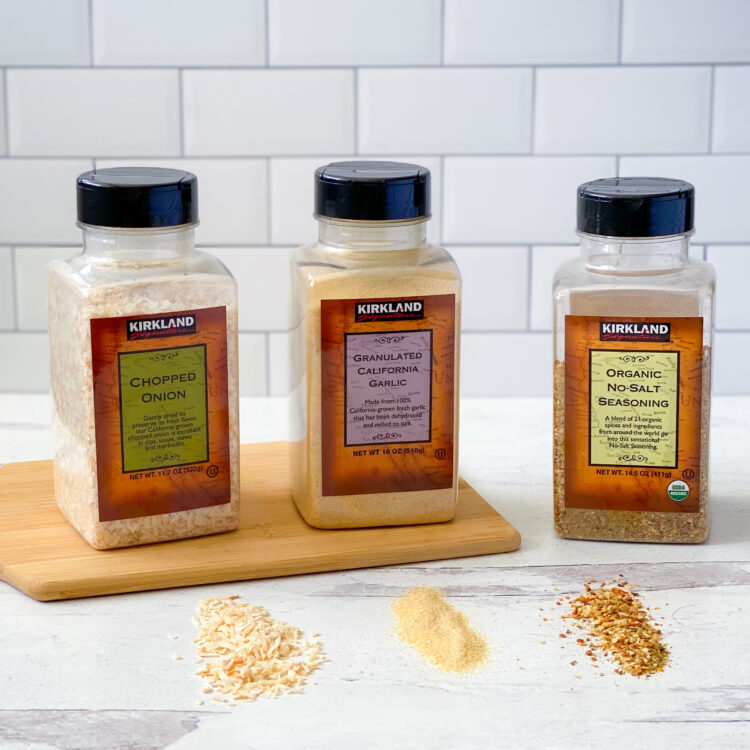
You are a GUI agent. You are given a task and a screenshot of the screen. Output one action in this format:
    pyautogui.click(x=<x>, y=<y>)
    Task: Click on the white subway tile backsplash
    
    Given the screenshot: What is the action you would take?
    pyautogui.click(x=438, y=111)